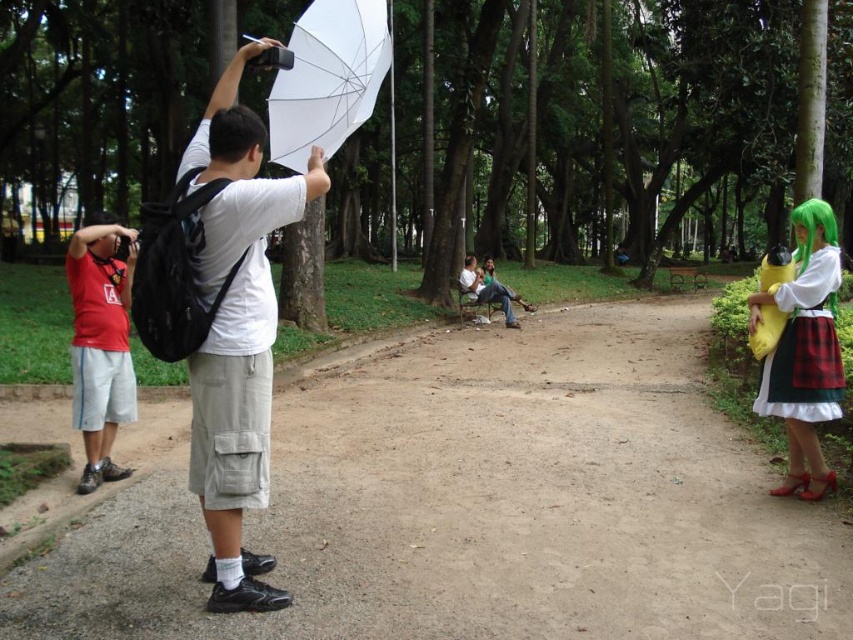
Is dirt path at center below matte white umbrella at upper left?

Correct, dirt path at center is located below matte white umbrella at upper left.

Is dirt path at center taller than matte white umbrella at upper left?

Incorrect, dirt path at center's height is not larger of matte white umbrella at upper left's.

Between point (503, 525) and point (212, 480), which one is positioned behind?

The point (503, 525) is more distant.

The width and height of the screenshot is (853, 640). Identify the location of dirt path at center. (480, 508).

From the picture: Who is more forward, [199,362] or [515,292]?

Point [199,362] is more forward.

Consider the image. Is matte white umbrella at upper left bigger than white fabric chair at center?

Result: Incorrect, matte white umbrella at upper left is not larger than white fabric chair at center.

What do you see at coordinates (236, 332) in the screenshot? I see `matte white umbrella at upper left` at bounding box center [236, 332].

Where is `matte white umbrella at upper left`? The width and height of the screenshot is (853, 640). matte white umbrella at upper left is located at coordinates click(x=236, y=332).

Is matte white umbrella at upper left to the right of matte red t-shirt at left from the viewer's perspective?

Correct, you'll find matte white umbrella at upper left to the right of matte red t-shirt at left.

Is point (259, 284) positioned before point (90, 358)?

Yes.

Image resolution: width=853 pixels, height=640 pixels. Identify the location of matte white umbrella at upper left. (236, 332).